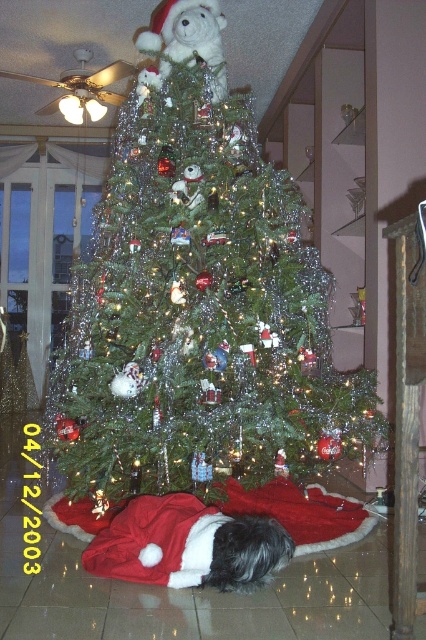
Question: Does shiny metallic tree at center appear on the right side of white soft dog at lower center?

Choices:
 (A) no
 (B) yes

Answer: (A)

Question: Is the position of shiny metallic tree at center more distant than that of white plush santa at upper center?

Choices:
 (A) yes
 (B) no

Answer: (B)

Question: Which of these objects is positioned closest to the white soft dog at lower center?

Choices:
 (A) shiny metallic tree at center
 (B) white plush santa at upper center

Answer: (A)

Question: Among these points, which one is nearest to the camera?

Choices:
 (A) (261, 561)
 (B) (193, 440)

Answer: (A)

Question: Is shiny metallic tree at center behind white soft dog at lower center?

Choices:
 (A) no
 (B) yes

Answer: (B)

Question: Which point is farther from the camera taking this photo?

Choices:
 (A) (181, 570)
 (B) (189, 49)

Answer: (B)